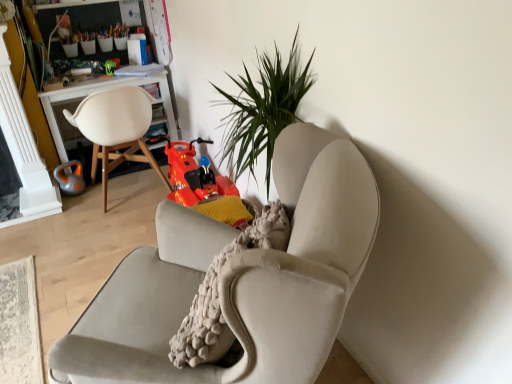
Identify the location of free spot in front of shiny green toy at upper left, which appears as the 1th toy when viewed from the top. 108,79.